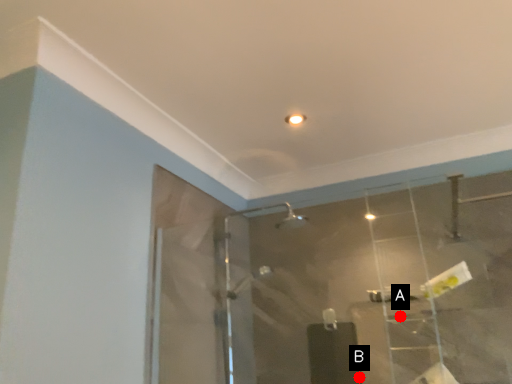
Question: Two points are circled on the image, labeled by A and B beside each circle. Which point is further to the camera?

Choices:
 (A) A is further
 (B) B is further

Answer: (A)